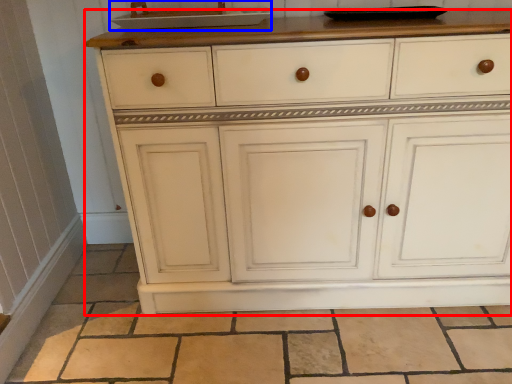
Question: Which of the following is the farthest to the observer, chest of drawers (highlighted by a red box) or sink (highlighted by a blue box)?

Choices:
 (A) chest of drawers
 (B) sink

Answer: (B)